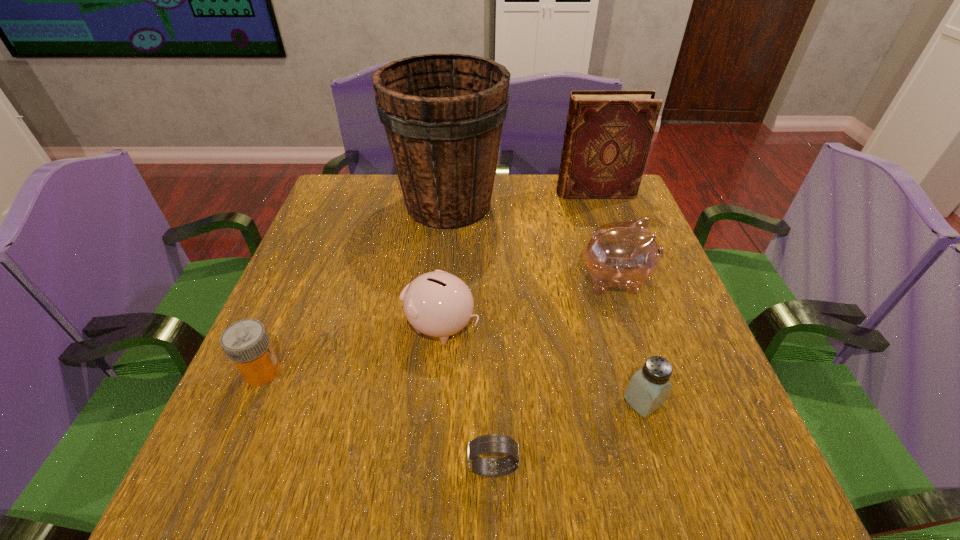
Where is `empty location between the saltshaker and the fifth shortest object`? This screenshot has height=540, width=960. empty location between the saltshaker and the fifth shortest object is located at coordinates (630, 340).

You are a GUI agent. You are given a task and a screenshot of the screen. Output one action in this format:
    pyautogui.click(x=<x>, y=<y>)
    Task: Click on the fourth closest object to the leftmost object
    The height and width of the screenshot is (540, 960).
    Given the screenshot: What is the action you would take?
    pyautogui.click(x=625, y=254)

Image resolution: width=960 pixels, height=540 pixels. I want to click on object that stands as the fourth closest to the farther piggy bank, so pos(608,135).

Identify the location of free space in the image that satisfies the following two spatial constraints: 1. on the front side of the shorter piggy bank; 2. on the left side of the bucket. (438, 326).

I want to click on free region that satisfies the following two spatial constraints: 1. on the back side of the saltshaker; 2. on the front facing side of the farther piggy bank, so point(607,279).